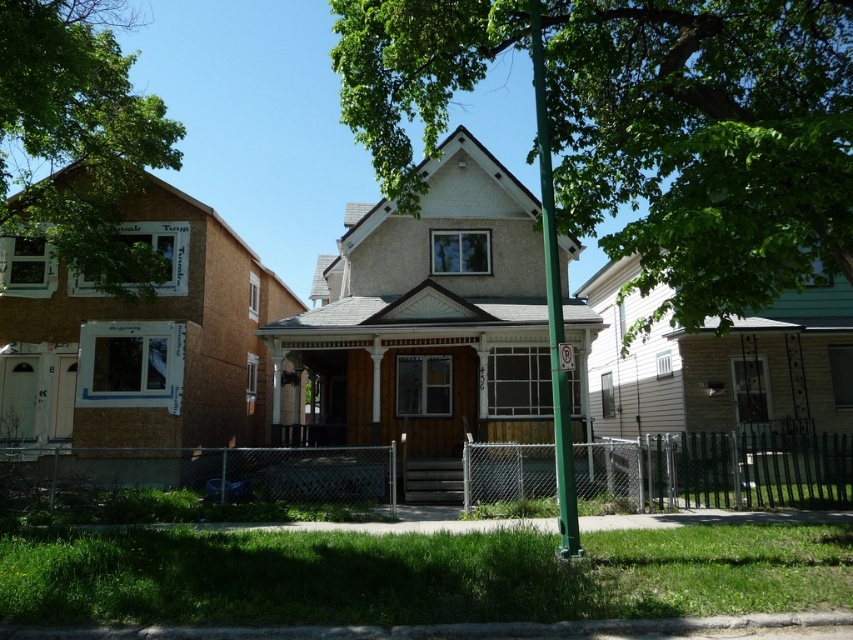
Question: Is the position of green leafy tree at left more distant than that of green metallic pole at center?

Choices:
 (A) yes
 (B) no

Answer: (A)

Question: Which object is closer to the camera taking this photo?

Choices:
 (A) metallic reflective no parking sign at center
 (B) green leafy tree at left
 (C) green metallic pole at center

Answer: (A)

Question: Does green leafy tree at left appear on the right side of metallic reflective no parking sign at center?

Choices:
 (A) yes
 (B) no

Answer: (B)

Question: Does green leafy tree at center appear under metallic reflective no parking sign at center?

Choices:
 (A) no
 (B) yes

Answer: (A)

Question: Which point is closer to the camera?

Choices:
 (A) (616, 19)
 (B) (22, 113)
 (C) (556, 401)
 (D) (561, 369)

Answer: (C)

Question: Among these objects, which one is nearest to the camera?

Choices:
 (A) green leafy tree at center
 (B) green metallic pole at center
 (C) green leafy tree at left
 (D) metallic reflective no parking sign at center

Answer: (A)